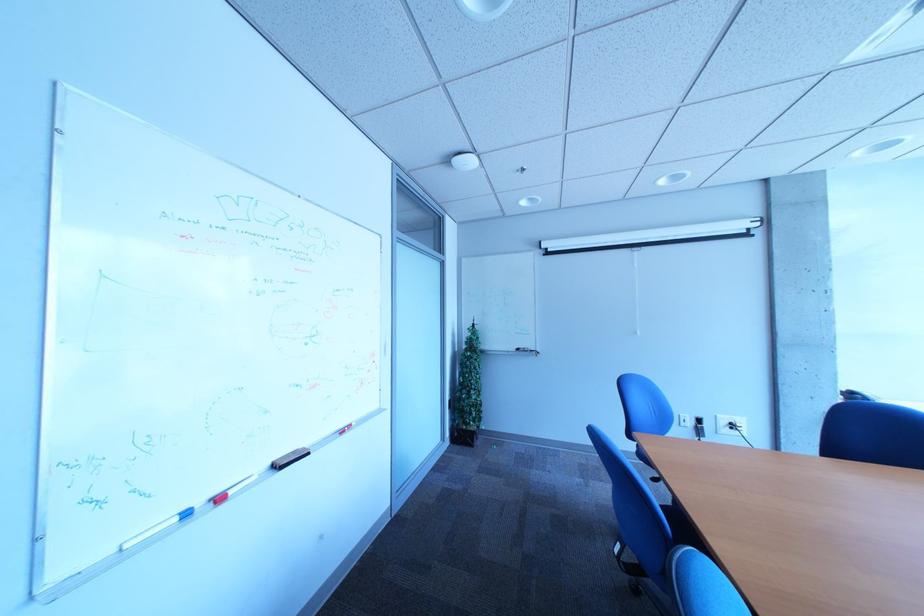
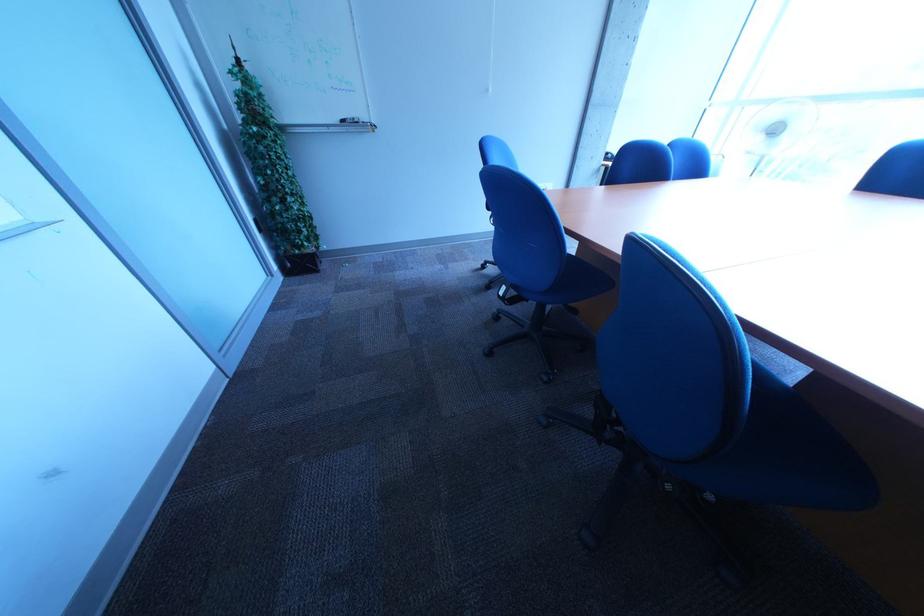
The first image is from the beginning of the video and the second image is from the end. How did the camera likely rotate when shooting the video?

The camera rotated toward right-down.